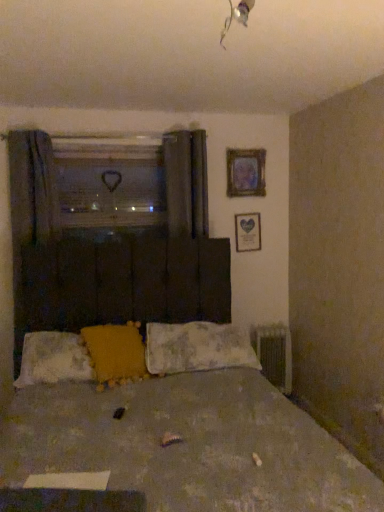
Question: From a real-world perspective, does clear plastic heart at upper center stand above matte glass picture frame at upper right, positioned as the 2th picture frame in bottom-to-top order?

Choices:
 (A) no
 (B) yes

Answer: (A)

Question: Can you confirm if clear plastic heart at upper center is positioned to the right of matte glass picture frame at upper right, acting as the first picture frame starting from the top?

Choices:
 (A) no
 (B) yes

Answer: (A)

Question: Considering the relative sizes of clear plastic heart at upper center and matte glass picture frame at upper right, acting as the first picture frame starting from the top, in the image provided, is clear plastic heart at upper center smaller than matte glass picture frame at upper right, acting as the first picture frame starting from the top,?

Choices:
 (A) yes
 (B) no

Answer: (B)

Question: From the image's perspective, is clear plastic heart at upper center on top of matte glass picture frame at upper right, acting as the first picture frame starting from the top?

Choices:
 (A) yes
 (B) no

Answer: (B)

Question: Is clear plastic heart at upper center outside matte glass picture frame at upper right, positioned as the 2th picture frame in bottom-to-top order?

Choices:
 (A) no
 (B) yes

Answer: (B)

Question: Is fluffy white pillow at lower left, the 1th pillow in the left-to-right sequence, taller or shorter than fluffy fabric pillow at center, arranged as the 1th pillow when viewed from the right?

Choices:
 (A) tall
 (B) short

Answer: (B)

Question: Does point (44, 367) appear closer or farther from the camera than point (225, 343)?

Choices:
 (A) closer
 (B) farther

Answer: (A)

Question: In the image, is fluffy white pillow at lower left, the 1th pillow in the left-to-right sequence, on the left side or the right side of fluffy fabric pillow at center, arranged as the 1th pillow when viewed from the right?

Choices:
 (A) right
 (B) left

Answer: (B)

Question: From a real-world perspective, is fluffy white pillow at lower left, marked as the 3th pillow in a right-to-left arrangement, physically located above or below fluffy fabric pillow at center, arranged as the 1th pillow when viewed from the right?

Choices:
 (A) above
 (B) below

Answer: (A)

Question: Relative to clear plastic heart at upper center, is fluffy fabric pillow at center, arranged as the 1th pillow when viewed from the right, in front or behind?

Choices:
 (A) front
 (B) behind

Answer: (A)

Question: Considering the positions of fluffy fabric pillow at center, which is the 3th pillow from left to right, and clear plastic heart at upper center in the image, is fluffy fabric pillow at center, which is the 3th pillow from left to right, bigger or smaller than clear plastic heart at upper center?

Choices:
 (A) big
 (B) small

Answer: (A)

Question: Looking at their shapes, would you say fluffy fabric pillow at center, which is the 3th pillow from left to right, is wider or thinner than clear plastic heart at upper center?

Choices:
 (A) thin
 (B) wide

Answer: (B)

Question: Considering the positions of point (178, 339) and point (117, 201), is point (178, 339) closer or farther from the camera than point (117, 201)?

Choices:
 (A) closer
 (B) farther

Answer: (A)

Question: Based on their sizes in the image, would you say clear plastic heart at upper center is bigger or smaller than dark gray fabric curtain at left?

Choices:
 (A) small
 (B) big

Answer: (A)

Question: Does point (94, 153) appear closer or farther from the camera than point (34, 180)?

Choices:
 (A) closer
 (B) farther

Answer: (B)